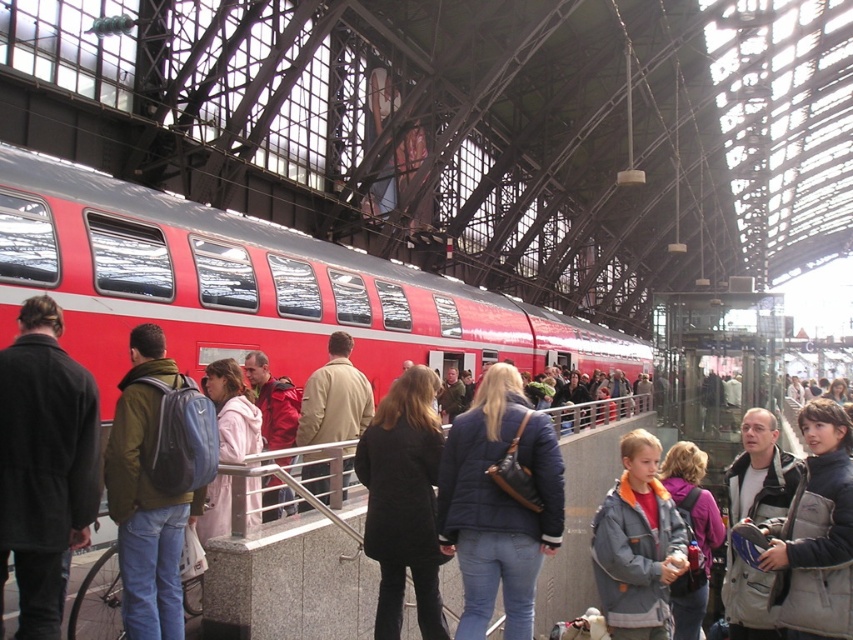
Is point (370, 508) closer to camera compared to point (219, 435)?

Yes.

Who is more forward, (381, 449) or (224, 512)?

Positioned in front is point (224, 512).

This screenshot has height=640, width=853. I want to click on black wool coat at center, so click(x=403, y=500).

Between point (483, 444) and point (415, 387), which one is positioned behind?

Positioned behind is point (415, 387).

Does navy blue quilted jacket at center have a lesser height compared to black wool coat at center?

No, navy blue quilted jacket at center is not shorter than black wool coat at center.

What do you see at coordinates (498, 504) in the screenshot? I see `navy blue quilted jacket at center` at bounding box center [498, 504].

In order to click on navy blue quilted jacket at center in this screenshot , I will do `click(498, 504)`.

Does gray fleece jacket at center appear over light pink fabric coat at center?

No.

Is gray fleece jacket at center thinner than light pink fabric coat at center?

Correct, gray fleece jacket at center's width is less than light pink fabric coat at center's.

Where is `gray fleece jacket at center`? gray fleece jacket at center is located at coordinates (637, 545).

You are a GUI agent. You are given a task and a screenshot of the screen. Output one action in this format:
    pyautogui.click(x=<x>, y=<y>)
    Task: Click on the gray fleece jacket at center
    
    Given the screenshot: What is the action you would take?
    [x=637, y=545]